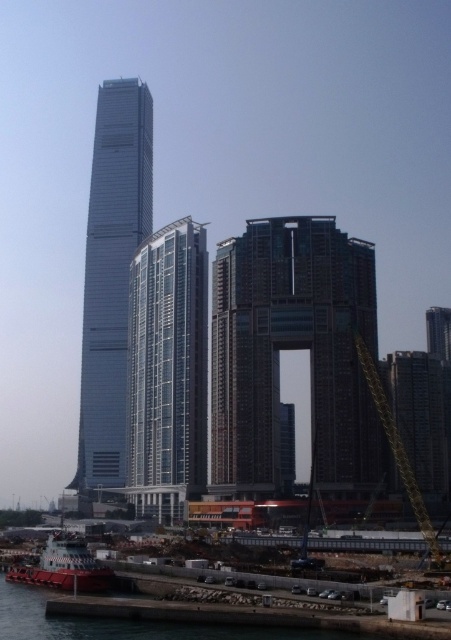
In the scene shown: You are a city planner assessing the urban layout. Given the brown textured building at center and the metallic red boat at lower left, which one occupies more space in the scene?

The brown textured building at center has a larger size compared to the metallic red boat at lower left, so it occupies more space in the scene.

From the picture: You are standing at the coordinates point 0.0, 0.0 in the image. You want to locate the brown textured building at center. In which direction should you look?

The brown textured building at center is located at point (291, 349), so you should look towards the upper right direction from your current position at point (0, 0).